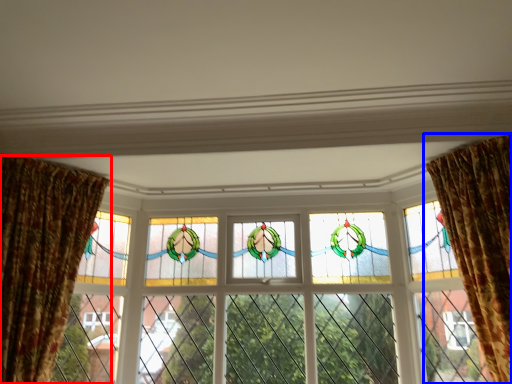
Question: Which object appears farthest to the camera in this image, curtain (highlighted by a red box) or curtain (highlighted by a blue box)?

Choices:
 (A) curtain
 (B) curtain

Answer: (A)